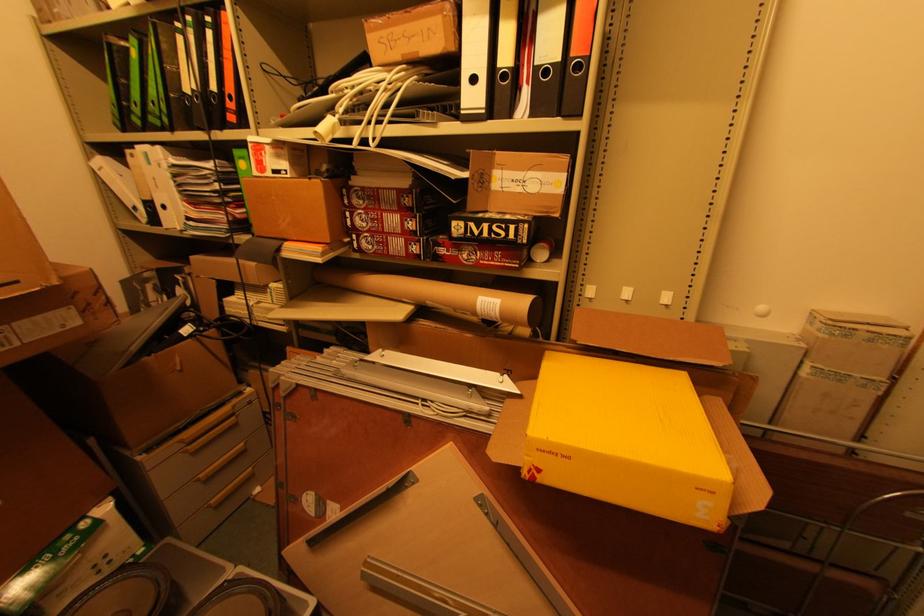
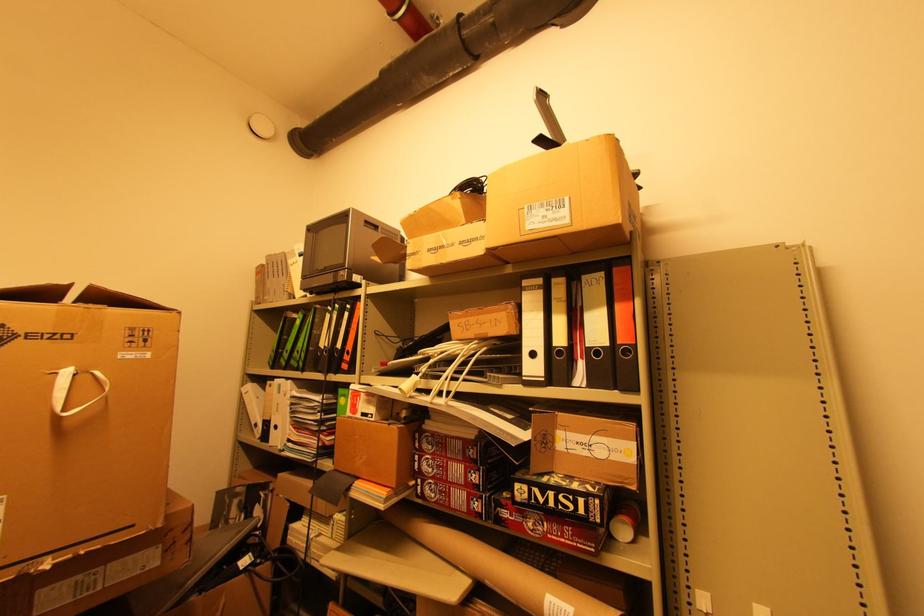
Question: I am providing you with two images of the same scene from different viewpoints. Please identify which objects are invisible in image2.

Choices:
 (A) rolled cardboard tube
 (B) small gray microwave
 (C) white box handle
 (D) none of these

Answer: (D)